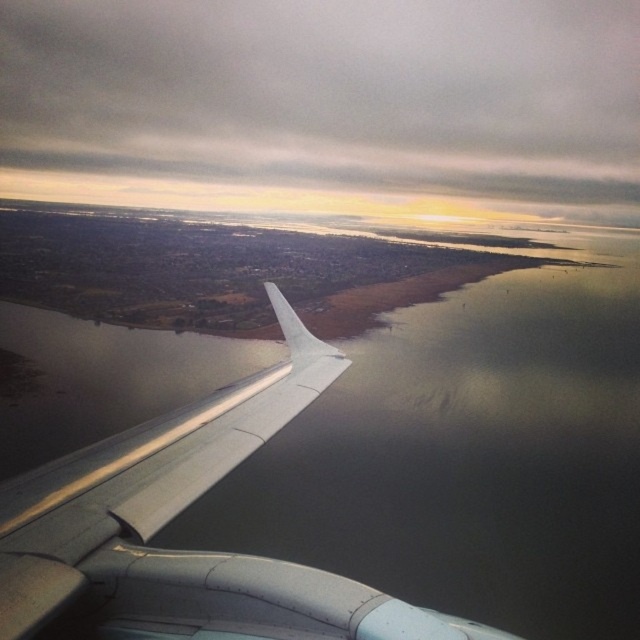
Is point (563, 99) more distant than point (36, 579)?

That is True.

Between point (403, 8) and point (84, 548), which one is positioned in front?

Point (84, 548) is in front.

Where is `gray matte cloud at upper center`? Image resolution: width=640 pixels, height=640 pixels. gray matte cloud at upper center is located at coordinates (324, 106).

Where is `gray matte cloud at upper center`? The width and height of the screenshot is (640, 640). gray matte cloud at upper center is located at coordinates (324, 106).